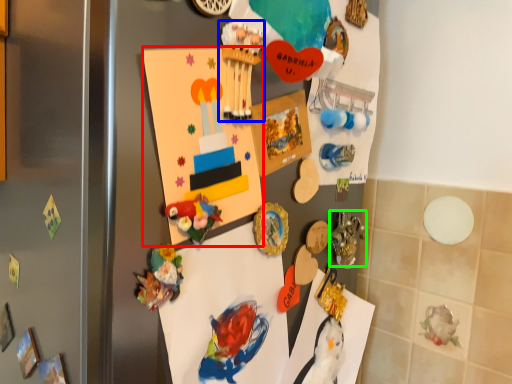
Question: Considering the real-world distances, which object is closest to postcard (highlighted by a red box)? toy (highlighted by a blue box) or art (highlighted by a green box).

Choices:
 (A) toy
 (B) art

Answer: (A)